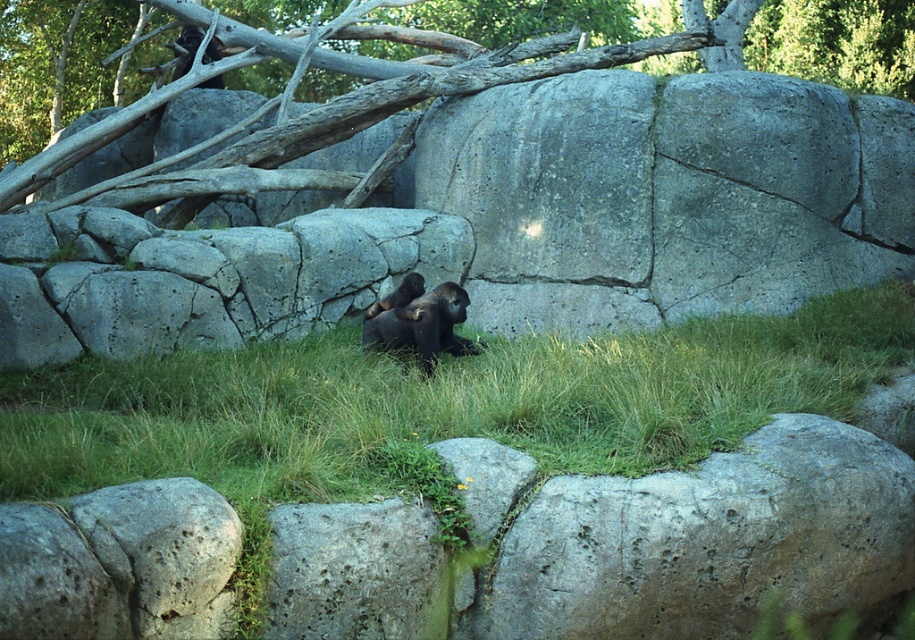
Question: Which point appears farthest from the camera in this image?

Choices:
 (A) (402, 324)
 (B) (671, 353)
 (C) (408, 301)
 (D) (891, 52)

Answer: (D)

Question: Which of these objects is positioned closest to the gray bark tree trunk at upper center?

Choices:
 (A) black fur gorilla at center
 (B) shiny black gorilla at center

Answer: (B)

Question: Does green grassy at center appear over shiny black gorilla at center?

Choices:
 (A) yes
 (B) no

Answer: (B)

Question: In this image, where is green grassy at center located relative to shiny black gorilla at center?

Choices:
 (A) left
 (B) right

Answer: (A)

Question: Which object is farther from the camera taking this photo?

Choices:
 (A) shiny black gorilla at center
 (B) black fur gorilla at center
 (C) gray bark tree trunk at upper center

Answer: (C)

Question: Considering the relative positions of green grassy at center and shiny black gorilla at center in the image provided, where is green grassy at center located with respect to shiny black gorilla at center?

Choices:
 (A) right
 (B) left

Answer: (B)